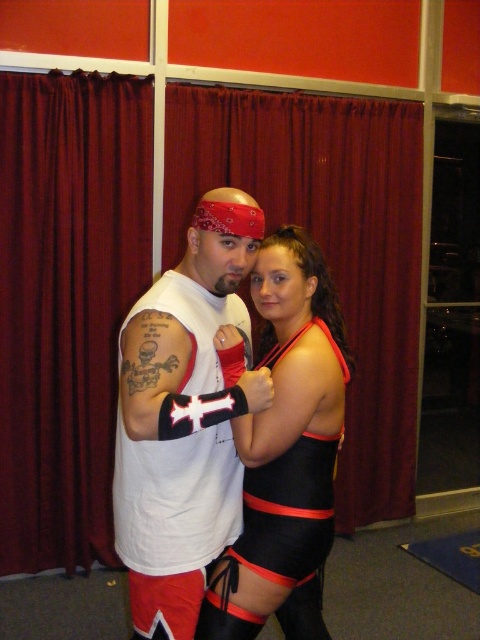
Question: Can you confirm if red velvet curtain at center is wider than black matte wrestling outfit at center?

Choices:
 (A) no
 (B) yes

Answer: (B)

Question: Estimate the real-world distances between objects in this image. Which object is closer to the black matte wrestling outfit at center?

Choices:
 (A) white matte tank top at center
 (B) red velvet curtain at center

Answer: (A)

Question: Does red velvet curtain at center appear under black matte wrestling outfit at center?

Choices:
 (A) yes
 (B) no

Answer: (B)

Question: Which point is closer to the camera?

Choices:
 (A) black matte wrestling outfit at center
 (B) red velvet curtain at center
 (C) white matte tank top at center

Answer: (C)

Question: Can you confirm if red velvet curtain at center is wider than white matte tank top at center?

Choices:
 (A) no
 (B) yes

Answer: (B)

Question: Estimate the real-world distances between objects in this image. Which object is closer to the white matte tank top at center?

Choices:
 (A) black matte wrestling outfit at center
 (B) red velvet curtain at center

Answer: (A)